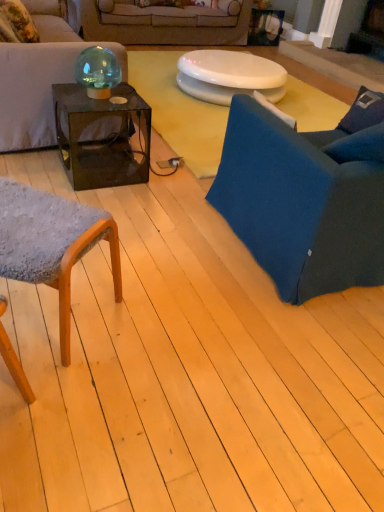
Question: Looking at the image, does teal glass sphere at upper left seem bigger or smaller compared to textured gray fabric chair at lower left, which is the second chair in right-to-left order?

Choices:
 (A) small
 (B) big

Answer: (A)

Question: Is teal glass sphere at upper left taller or shorter than textured gray fabric chair at lower left, which is the second chair in right-to-left order?

Choices:
 (A) tall
 (B) short

Answer: (B)

Question: Based on their relative distances, which object is nearer to the transparent glass cube at center?

Choices:
 (A) teal glass sphere at upper left
 (B) matte black couch at upper left, placed as the first studio couch when sorted from front to back
 (C) blue fabric chair at right, which is the second chair from left to right
 (D) white glossy toilet seat at center
 (E) textured gray fabric chair at lower left, which is the second chair in right-to-left order

Answer: (A)

Question: Estimate the real-world distances between objects in this image. Which object is closer to the blue fabric chair at right, which is the second chair from left to right?

Choices:
 (A) textured gray fabric chair at lower left, which is the second chair in right-to-left order
 (B) white glossy toilet seat at center
 (C) fluffy fabric pillow at upper left
 (D) transparent glass cube at center
 (E) matte black couch at upper left, placed as the first studio couch when sorted from front to back

Answer: (A)